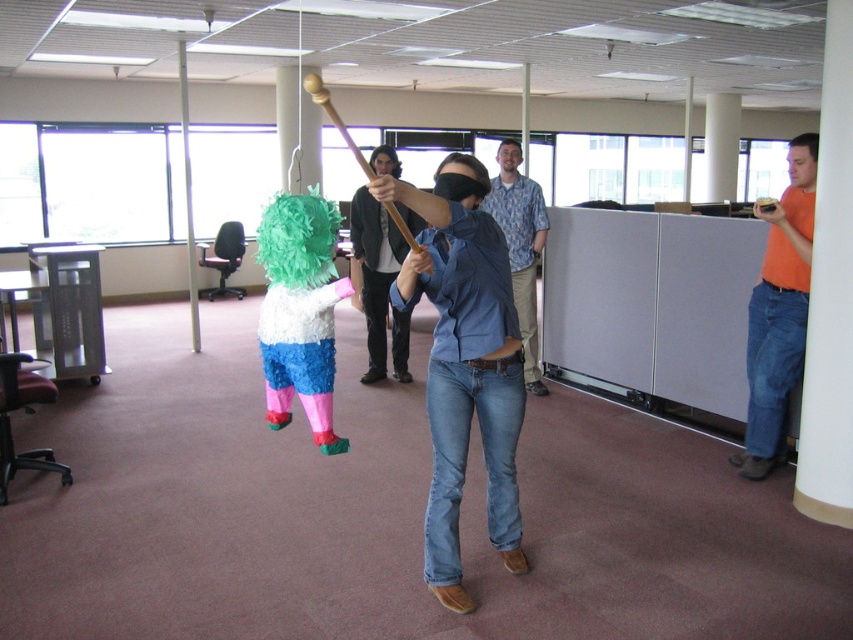
Looking at this image, you are organizing an office event and need to ensure that the orange cotton shirt at right and the denim jeans at center are visible in the group photo. Since the photographer wants to focus on the pi?ata, which clothing item should be positioned higher to avoid blocking the view?

The orange cotton shirt at right should be positioned higher than the denim jeans at center because the denim jeans at center is currently below the orange cotton shirt at right.

You are standing in the office and notice two pairs of blue denim jeans at center. Which one is positioned to the left?

The denim jeans at center is positioned to the left of the blue denim jeans at center.